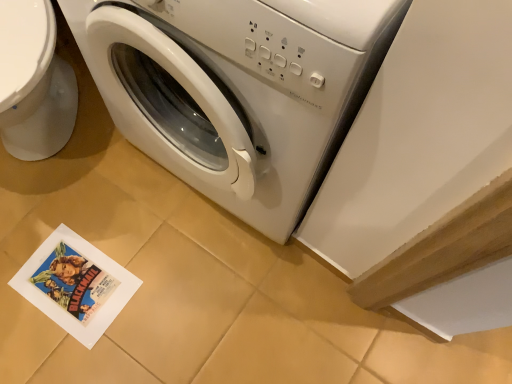
Question: Could you tell me if white glossy toilet bowl at left is turned towards white glossy washing machine at center?

Choices:
 (A) yes
 (B) no

Answer: (B)

Question: Is white glossy toilet bowl at left oriented away from white glossy washing machine at center?

Choices:
 (A) no
 (B) yes

Answer: (A)

Question: Are white glossy toilet bowl at left and white glossy washing machine at center making contact?

Choices:
 (A) yes
 (B) no

Answer: (B)

Question: Can you confirm if white glossy toilet bowl at left is positioned to the left of white glossy washing machine at center?

Choices:
 (A) yes
 (B) no

Answer: (A)

Question: Considering the relative sizes of white glossy toilet bowl at left and white glossy washing machine at center in the image provided, is white glossy toilet bowl at left thinner than white glossy washing machine at center?

Choices:
 (A) yes
 (B) no

Answer: (B)

Question: From the image's perspective, is white glossy toilet bowl at left under white glossy washing machine at center?

Choices:
 (A) no
 (B) yes

Answer: (A)

Question: From the image's perspective, is white glossy washing machine at center below white glossy toilet bowl at left?

Choices:
 (A) yes
 (B) no

Answer: (A)

Question: Considering the relative positions of white glossy washing machine at center and white glossy toilet bowl at left in the image provided, is white glossy washing machine at center to the right of white glossy toilet bowl at left from the viewer's perspective?

Choices:
 (A) no
 (B) yes

Answer: (B)

Question: Could you tell me if white glossy washing machine at center is facing white glossy toilet bowl at left?

Choices:
 (A) no
 (B) yes

Answer: (A)

Question: Is white glossy washing machine at center not near white glossy toilet bowl at left?

Choices:
 (A) no
 (B) yes

Answer: (A)

Question: Is the position of white glossy washing machine at center less distant than that of white glossy toilet bowl at left?

Choices:
 (A) no
 (B) yes

Answer: (B)

Question: Is white glossy washing machine at center surrounding white glossy toilet bowl at left?

Choices:
 (A) no
 (B) yes

Answer: (A)

Question: Is white glossy toilet bowl at left to the left or to the right of white glossy washing machine at center in the image?

Choices:
 (A) right
 (B) left

Answer: (B)